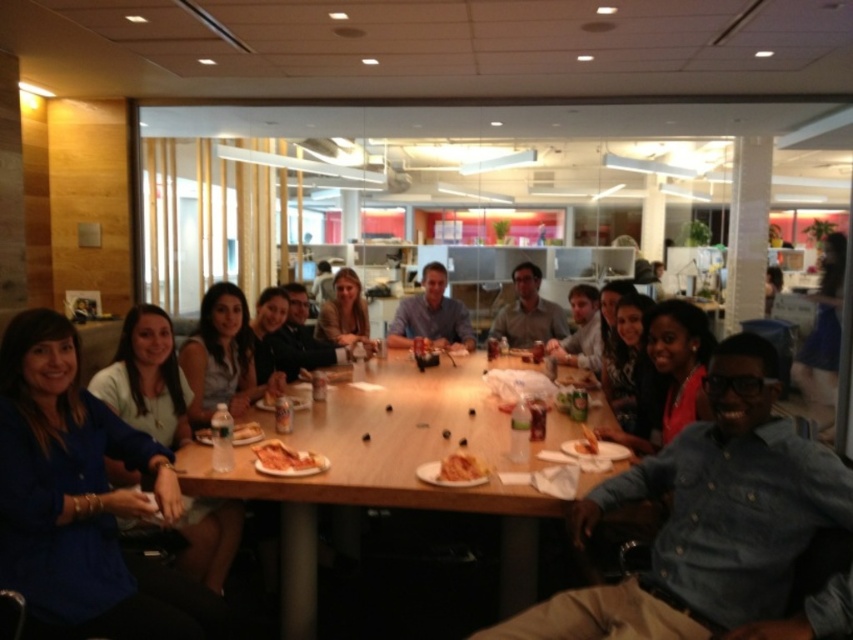
You are a food critic who needs to determine which item is taller between the golden crispy pastry at center and the golden crispy fries at center on the table. Based on the scene description, which one is taller?

The golden crispy pastry at center is much taller than the golden crispy fries at center, so the pastry is taller.

You are a new employee at the office and you want to grab the golden crispy pizza at center without touching the denim shirt at center. Is this possible?

The denim shirt at center is located below the golden crispy pizza at center, so you can reach the golden crispy pizza at center without touching the denim shirt at center by grabbing it from above.